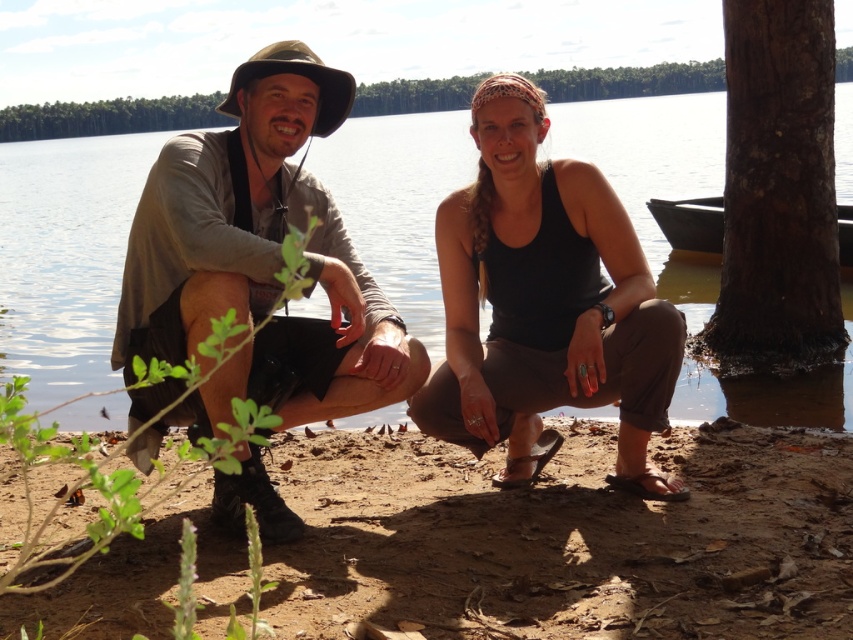
Between brown dirt at lower center and brown fabric hat at left, which one appears on the left side from the viewer's perspective?

brown fabric hat at left

Does point (363, 596) lie behind point (344, 74)?

No, (363, 596) is in front of (344, 74).

Who is more forward, (335,532) or (328,122)?

Positioned in front is point (335,532).

Identify the location of brown dirt at lower center. (567, 540).

Is point (801, 182) positioned behind point (286, 54)?

That is True.

Can you confirm if brown rough bark tree at right is taller than brown fabric hat at left?

Indeed, brown rough bark tree at right has a greater height compared to brown fabric hat at left.

I want to click on brown rough bark tree at right, so click(x=776, y=192).

Which of these two, brown fabric hat at left or dark brown wooden canoe at right, stands shorter?

brown fabric hat at left

How much distance is there between brown fabric hat at left and dark brown wooden canoe at right?

brown fabric hat at left and dark brown wooden canoe at right are 7.57 meters apart from each other.

The image size is (853, 640). What do you see at coordinates (299, 74) in the screenshot?
I see `brown fabric hat at left` at bounding box center [299, 74].

You are a GUI agent. You are given a task and a screenshot of the screen. Output one action in this format:
    pyautogui.click(x=<x>, y=<y>)
    Task: Click on the brown fabric hat at left
    The image size is (853, 640).
    Given the screenshot: What is the action you would take?
    pyautogui.click(x=299, y=74)